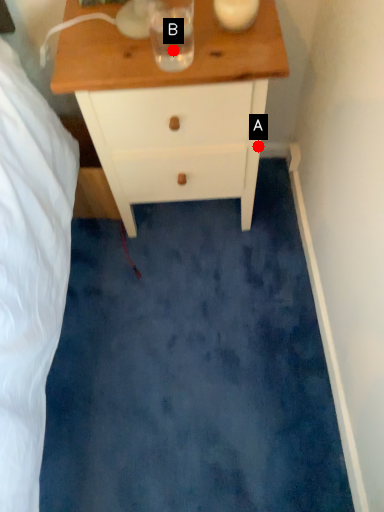
Question: Two points are circled on the image, labeled by A and B beside each circle. Which point appears farthest from the camera in this image?

Choices:
 (A) A is further
 (B) B is further

Answer: (A)